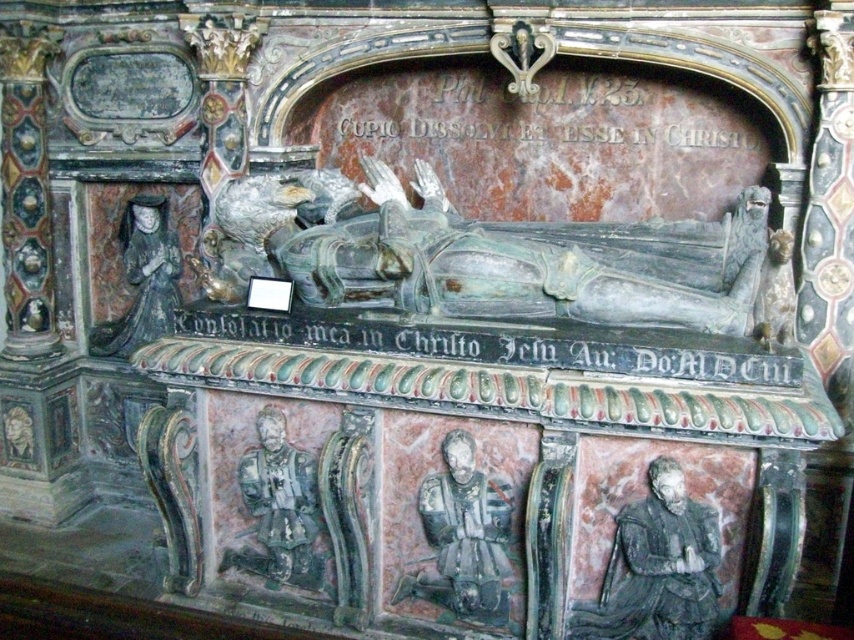
You are a historian measuring the spacing between artifacts for a museum layout. The bronze armor at lower left and the gray stone statue at left must be placed exactly 36 inches apart in the new exhibit. Based on their current distance, is there a need to adjust their positions?

The current distance between the bronze armor at lower left and the gray stone statue at left is 33.51 inches. Since the required spacing is 36 inches, the two items need to be moved further apart by approximately 2.49 inches to meet the exhibit requirements.